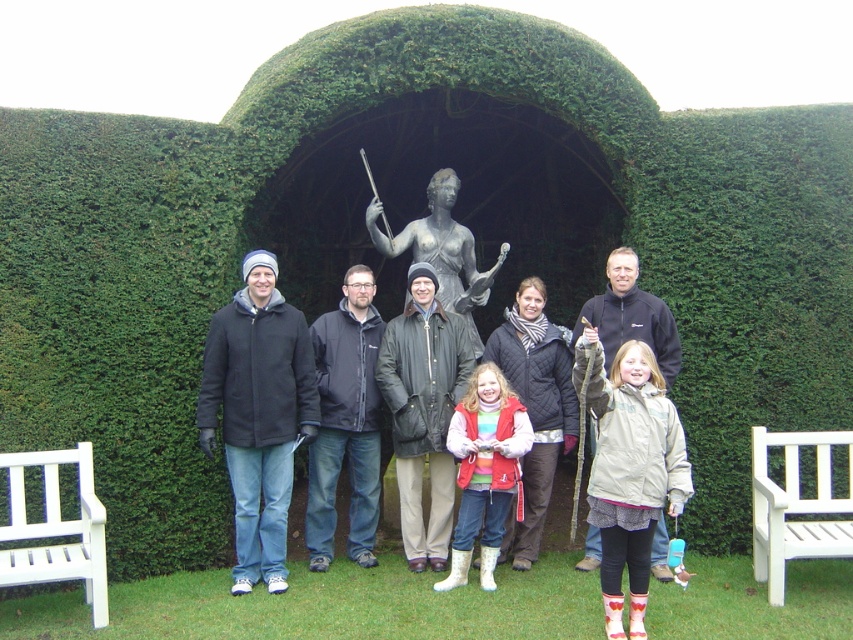
How much distance is there between quilted black jacket at center and white wooden bench at lower right?

They are 7.03 feet apart.

Is quilted black jacket at center above white wooden bench at lower right?

Correct, quilted black jacket at center is located above white wooden bench at lower right.

Is point (543, 426) positioned behind point (759, 520)?

That is True.

This screenshot has height=640, width=853. I want to click on quilted black jacket at center, so click(x=535, y=406).

Is point (397, 410) farther from viewer compared to point (465, 244)?

No, it is not.

Where is `dark brown leather jacket at center`? This screenshot has width=853, height=640. dark brown leather jacket at center is located at coordinates (422, 412).

Between red plaid vest at center and bronze statue at center, which one appears on the left side from the viewer's perspective?

bronze statue at center is more to the left.

Can you confirm if red plaid vest at center is bigger than bronze statue at center?

No.

Image resolution: width=853 pixels, height=640 pixels. I want to click on red plaid vest at center, so click(x=485, y=468).

This screenshot has height=640, width=853. I want to click on red plaid vest at center, so click(485, 468).